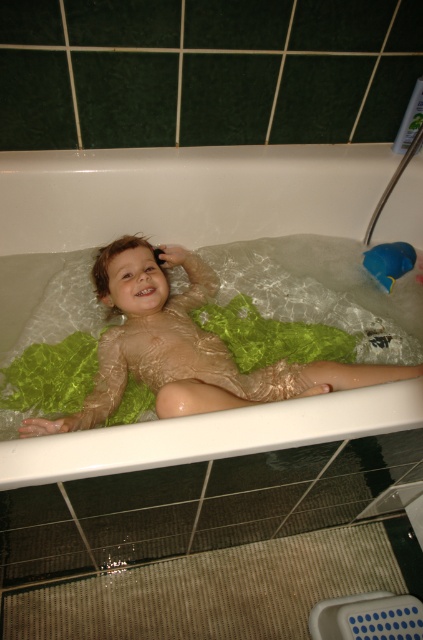
You are a parent checking the bath safety. You see the translucent plastic bag at center and the blue rubber duck at upper right. Which object is closer to the child in the bathtub?

The translucent plastic bag at center is closer to the child in the bathtub because it is closer to the viewer than the blue rubber duck at upper right.

Consider the image. You are a photographer taking a picture of the bath scene. You notice two points in the image at coordinates point (159, 458) and point (387, 288). Which point would appear larger in the photo?

Point (159, 458) is closer to the camera than point (387, 288), so it would appear larger in the photo.

You are a parent checking the bath toys for your child. You see the translucent plastic bag at center and the blue rubber duck at upper right. Which object is taller?

The translucent plastic bag at center is much taller than the blue rubber duck at upper right.